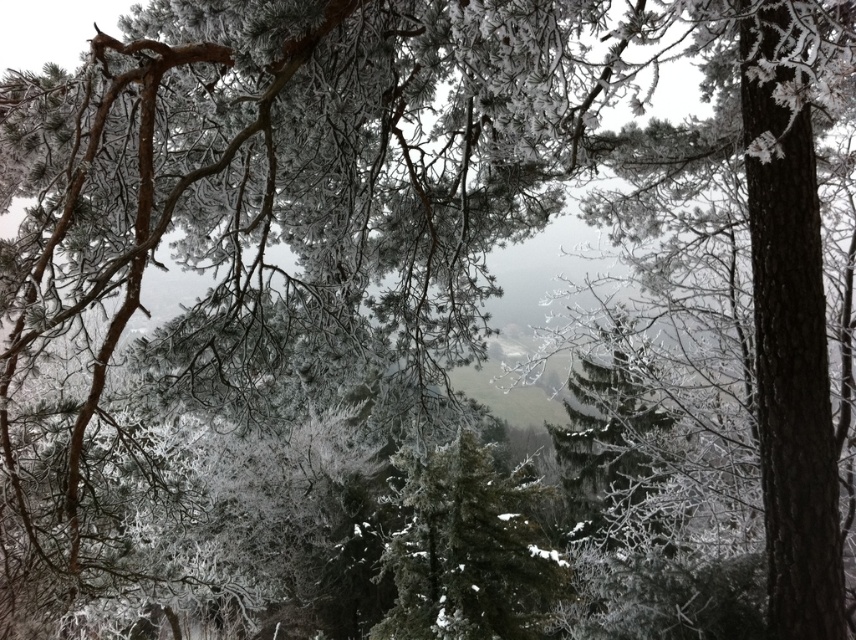
Is green matte tree at center bigger than frosted pine tree at center?

Actually, green matte tree at center might be smaller than frosted pine tree at center.

In the scene shown: Between green matte tree at center and frosted pine tree at center, which one has less height?

green matte tree at center is shorter.

You are a GUI agent. You are given a task and a screenshot of the screen. Output one action in this format:
    pyautogui.click(x=<x>, y=<y>)
    Task: Click on the green matte tree at center
    
    Given the screenshot: What is the action you would take?
    pyautogui.click(x=467, y=550)

Locate an element on the screen. green matte tree at center is located at coordinates (467, 550).